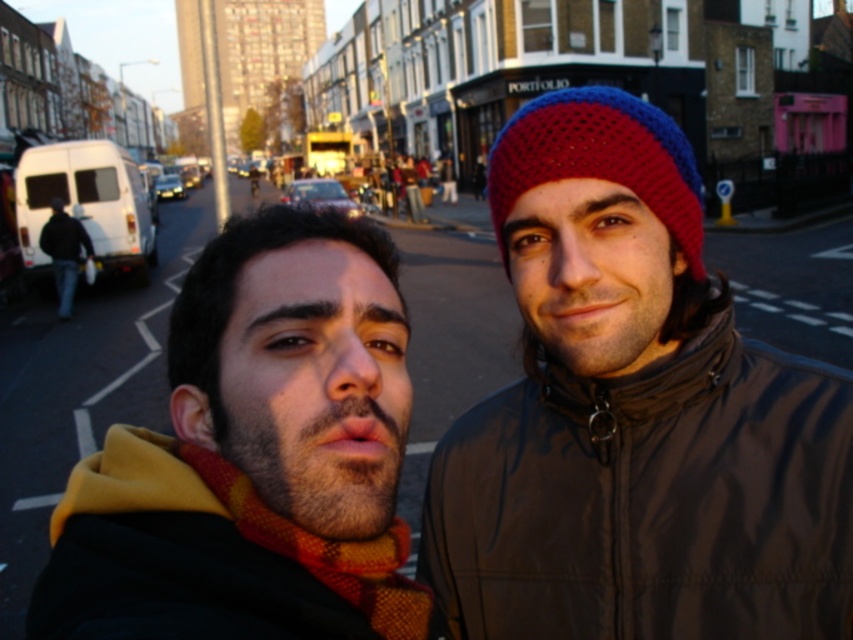
Question: Is matte black jacket at center positioned in front of knitted woolen beanie at center?

Choices:
 (A) no
 (B) yes

Answer: (B)

Question: Is matte black jacket at center positioned at the back of knitted woolen beanie at center?

Choices:
 (A) yes
 (B) no

Answer: (B)

Question: Is matte black jacket at center wider than knitted woolen beanie at center?

Choices:
 (A) yes
 (B) no

Answer: (B)

Question: Which of the following is the closest to the observer?

Choices:
 (A) matte black jacket at center
 (B) knitted woolen beanie at center

Answer: (A)